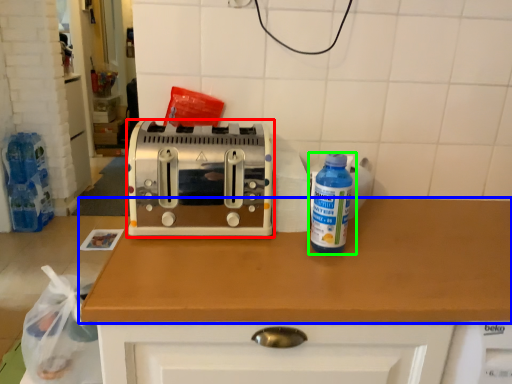
Question: Which object is the closest to the toaster (highlighted by a red box)? Choose among these: countertop (highlighted by a blue box) or bottle (highlighted by a green box).

Choices:
 (A) countertop
 (B) bottle

Answer: (A)